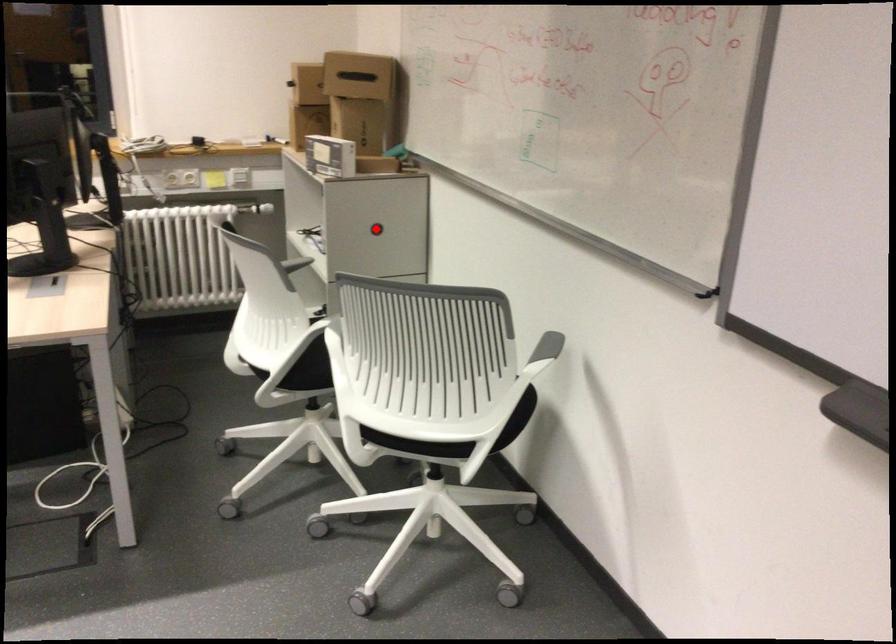
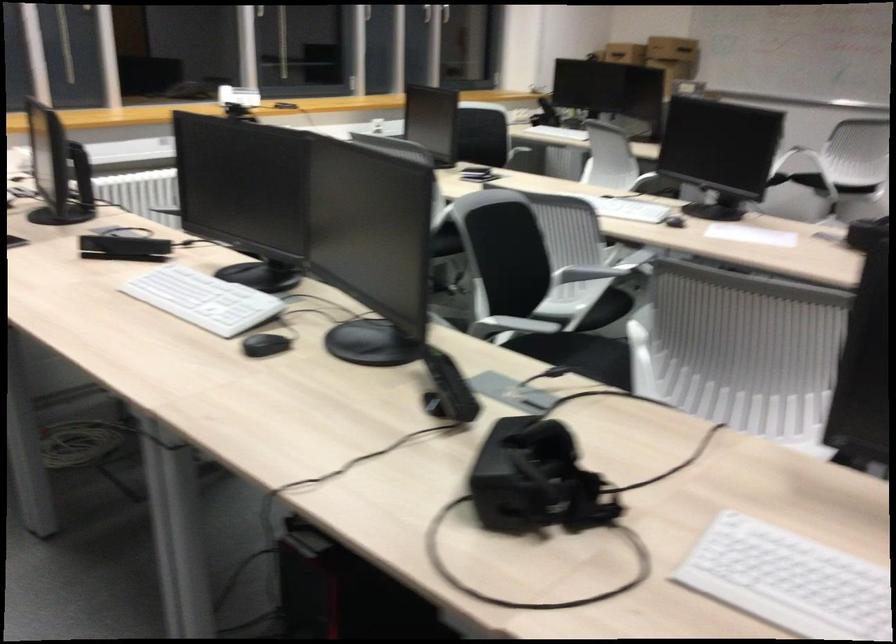
Question: I am providing you with two images of the same scene from different viewpoints. A red point is marked on the first image. Can you still see the location of the red point in image 2?

Choices:
 (A) Yes
 (B) No

Answer: (B)